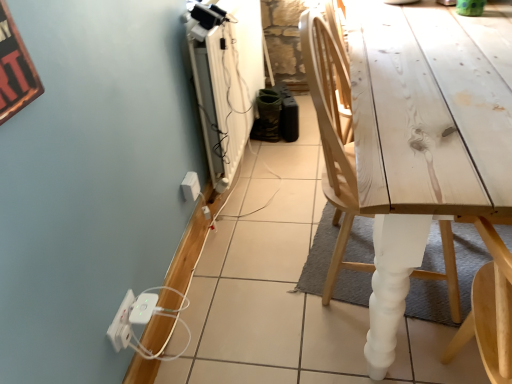
This screenshot has height=384, width=512. What are the coordinates of `natural wood chair at right` in the screenshot? It's located at (333, 136).

At what (x,y) coordinates should I click in order to perform the action: click on white plastic power strip at lower left, which is the second electric outlet in back-to-front order. Please return your answer as a coordinate pair (x, y). Image resolution: width=512 pixels, height=384 pixels. Looking at the image, I should click on (122, 324).

Locate an element on the screen. Image resolution: width=512 pixels, height=384 pixels. white plastic electric outlet at lower left, which is counted as the 1th electric outlet, starting from the back is located at coordinates (190, 186).

In the scene shown: Could you tell me if natural wood chair at right is facing white plastic extension cord at lower left?

No, natural wood chair at right is not facing towards white plastic extension cord at lower left.

Considering the positions of objects natural wood chair at right and white plastic extension cord at lower left in the image provided, who is behind, natural wood chair at right or white plastic extension cord at lower left?

white plastic extension cord at lower left is behind.

Does point (335, 282) lie behind point (137, 312)?

Yes.

Does natural wood chair at right have a lesser height compared to white plastic extension cord at lower left?

No, natural wood chair at right is not shorter than white plastic extension cord at lower left.

Are natural wood chair at right and white plastic electric outlet at lower left, the second electric outlet when ordered from bottom to top, located far from each other?

No, natural wood chair at right is in close proximity to white plastic electric outlet at lower left, the second electric outlet when ordered from bottom to top.

Considering the sizes of objects natural wood chair at right and white plastic electric outlet at lower left, positioned as the first electric outlet in right-to-left order, in the image provided, who is smaller, natural wood chair at right or white plastic electric outlet at lower left, positioned as the first electric outlet in right-to-left order,?

Smaller between the two is white plastic electric outlet at lower left, positioned as the first electric outlet in right-to-left order.

Is natural wood chair at right in front of or behind white plastic electric outlet at lower left, the second electric outlet when ordered from bottom to top, in the image?

In the image, natural wood chair at right appears in front of white plastic electric outlet at lower left, the second electric outlet when ordered from bottom to top.

Does natural wood chair at right turn towards white plastic electric outlet at lower left, which is counted as the 1th electric outlet, starting from the back?

No, natural wood chair at right is not oriented towards white plastic electric outlet at lower left, which is counted as the 1th electric outlet, starting from the back.

Who is taller, white plastic electric outlet at lower left, the 2th electric outlet from the left, or white plastic extension cord at lower left?

white plastic electric outlet at lower left, the 2th electric outlet from the left.

Is white plastic electric outlet at lower left, the 2th electric outlet from the left, outside of white plastic extension cord at lower left?

Yes.

At what (x,y) coordinates should I click in order to perform the action: click on extension cord that is in front of the white plastic electric outlet at lower left, the 2th electric outlet from the left. Please return your answer as a coordinate pair (x, y). This screenshot has width=512, height=384. Looking at the image, I should click on (143, 308).

Is point (197, 186) closer or farther from the camera than point (138, 300)?

Point (197, 186) is farther from the camera than point (138, 300).

Does white plastic extension cord at lower left have a greater width compared to natural wood chair at right?

No, white plastic extension cord at lower left is not wider than natural wood chair at right.

The image size is (512, 384). Find the location of `chair that appears on the right of white plastic extension cord at lower left`. chair that appears on the right of white plastic extension cord at lower left is located at coordinates (333, 136).

Does white plastic extension cord at lower left have a larger size compared to natural wood chair at right?

No.

Relative to natural wood chair at right, is white plastic extension cord at lower left in front or behind?

Visually, white plastic extension cord at lower left is located behind natural wood chair at right.

Could you tell me if white plastic extension cord at lower left is turned towards white plastic electric outlet at lower left, the 2th electric outlet from the left?

No.

Where is `extension cord below the white plastic electric outlet at lower left, acting as the second electric outlet starting from the front (from a real-world perspective)`? The image size is (512, 384). extension cord below the white plastic electric outlet at lower left, acting as the second electric outlet starting from the front (from a real-world perspective) is located at coordinates (143, 308).

From the image's perspective, which is below, white plastic extension cord at lower left or white plastic electric outlet at lower left, the 2th electric outlet from the left?

white plastic extension cord at lower left, from the image's perspective.

Can you confirm if white plastic extension cord at lower left is thinner than white plastic electric outlet at lower left, which is the first electric outlet from top to bottom?

Incorrect, the width of white plastic extension cord at lower left is not less than that of white plastic electric outlet at lower left, which is the first electric outlet from top to bottom.

From the picture: Between white plastic power strip at lower left, marked as the second electric outlet in a top-to-bottom arrangement, and white plastic extension cord at lower left, which one has larger size?

With larger size is white plastic extension cord at lower left.

Who is shorter, white plastic power strip at lower left, which is the second electric outlet in back-to-front order, or white plastic extension cord at lower left?

With less height is white plastic extension cord at lower left.

Looking at their sizes, would you say white plastic power strip at lower left, which is counted as the 1th electric outlet, starting from the bottom, is wider or thinner than white plastic extension cord at lower left?

Considering their sizes, white plastic power strip at lower left, which is counted as the 1th electric outlet, starting from the bottom, looks slimmer than white plastic extension cord at lower left.

Is white plastic extension cord at lower left inside white plastic power strip at lower left, which is counted as the 1th electric outlet, starting from the bottom?

No, white plastic extension cord at lower left is not inside white plastic power strip at lower left, which is counted as the 1th electric outlet, starting from the bottom.

Are white plastic electric outlet at lower left, which is counted as the 1th electric outlet, starting from the back, and natural wood chair at right located far from each other?

No, white plastic electric outlet at lower left, which is counted as the 1th electric outlet, starting from the back, is not far from natural wood chair at right.

Looking at the image, does white plastic electric outlet at lower left, positioned as the first electric outlet in right-to-left order, seem bigger or smaller compared to natural wood chair at right?

white plastic electric outlet at lower left, positioned as the first electric outlet in right-to-left order, is smaller than natural wood chair at right.

Is white plastic electric outlet at lower left, acting as the second electric outlet starting from the front, located outside natural wood chair at right?

Yes, white plastic electric outlet at lower left, acting as the second electric outlet starting from the front, is outside of natural wood chair at right.

From the image's perspective, is white plastic electric outlet at lower left, which is the first electric outlet from top to bottom, under natural wood chair at right?

Yes, from the image's perspective, white plastic electric outlet at lower left, which is the first electric outlet from top to bottom, is beneath natural wood chair at right.

In the image, there is a natural wood chair at right. Find the location of `extension cord below it (from a real-world perspective)`. extension cord below it (from a real-world perspective) is located at coordinates (143, 308).

You are a GUI agent. You are given a task and a screenshot of the screen. Output one action in this format:
    pyautogui.click(x=<x>, y=<y>)
    Task: Click on the electric outlet that is the 1st object to the left of the natural wood chair at right, starting at the anchor
    
    Given the screenshot: What is the action you would take?
    pyautogui.click(x=190, y=186)

From the image, which object appears to be farther from white plastic electric outlet at lower left, which is the first electric outlet from top to bottom, white plastic extension cord at lower left or natural wood chair at right?

natural wood chair at right is further to white plastic electric outlet at lower left, which is the first electric outlet from top to bottom.

Based on their spatial positions, is white plastic electric outlet at lower left, the 2th electric outlet from the left, or white plastic extension cord at lower left closer to white plastic power strip at lower left, acting as the 1th electric outlet starting from the front?

white plastic extension cord at lower left is closer to white plastic power strip at lower left, acting as the 1th electric outlet starting from the front.

Based on their spatial positions, is white plastic power strip at lower left, marked as the second electric outlet in a top-to-bottom arrangement, or natural wood chair at right closer to white plastic extension cord at lower left?

Based on the image, white plastic power strip at lower left, marked as the second electric outlet in a top-to-bottom arrangement, appears to be nearer to white plastic extension cord at lower left.

From the image, which object appears to be farther from natural wood chair at right, white plastic extension cord at lower left or white plastic power strip at lower left, acting as the 1th electric outlet starting from the left?

The object further to natural wood chair at right is white plastic power strip at lower left, acting as the 1th electric outlet starting from the left.

From the image, which object appears to be farther from natural wood chair at right, white plastic power strip at lower left, acting as the 1th electric outlet starting from the left, or white plastic electric outlet at lower left, acting as the second electric outlet starting from the front?

Based on the image, white plastic power strip at lower left, acting as the 1th electric outlet starting from the left, appears to be further to natural wood chair at right.

Looking at the image, which one is located further to natural wood chair at right, white plastic electric outlet at lower left, which is the first electric outlet from top to bottom, or white plastic extension cord at lower left?

Among the two, white plastic extension cord at lower left is located further to natural wood chair at right.

Considering their positions, is white plastic power strip at lower left, which ranks as the 2th electric outlet in right-to-left order, positioned closer to white plastic electric outlet at lower left, which is counted as the 1th electric outlet, starting from the back, than natural wood chair at right?

white plastic power strip at lower left, which ranks as the 2th electric outlet in right-to-left order, is closer to white plastic electric outlet at lower left, which is counted as the 1th electric outlet, starting from the back.

From the image, which object appears to be farther from white plastic extension cord at lower left, white plastic electric outlet at lower left, the second electric outlet when ordered from bottom to top, or natural wood chair at right?

natural wood chair at right is further to white plastic extension cord at lower left.

Find the location of a particular element. The width and height of the screenshot is (512, 384). electric outlet between white plastic power strip at lower left, acting as the 1th electric outlet starting from the front, and natural wood chair at right is located at coordinates (190, 186).

What are the coordinates of `extension cord located between white plastic power strip at lower left, acting as the 1th electric outlet starting from the front, and natural wood chair at right in the left-right direction` in the screenshot? It's located at (143, 308).

You are a GUI agent. You are given a task and a screenshot of the screen. Output one action in this format:
    pyautogui.click(x=<x>, y=<y>)
    Task: Click on the extension cord between white plastic power strip at lower left, marked as the second electric outlet in a top-to-bottom arrangement, and white plastic electric outlet at lower left, acting as the second electric outlet starting from the front, in the front-back direction
    The image size is (512, 384).
    Given the screenshot: What is the action you would take?
    pyautogui.click(x=143, y=308)

Find the location of a particular element. The image size is (512, 384). electric outlet between white plastic extension cord at lower left and natural wood chair at right in the horizontal direction is located at coordinates (190, 186).